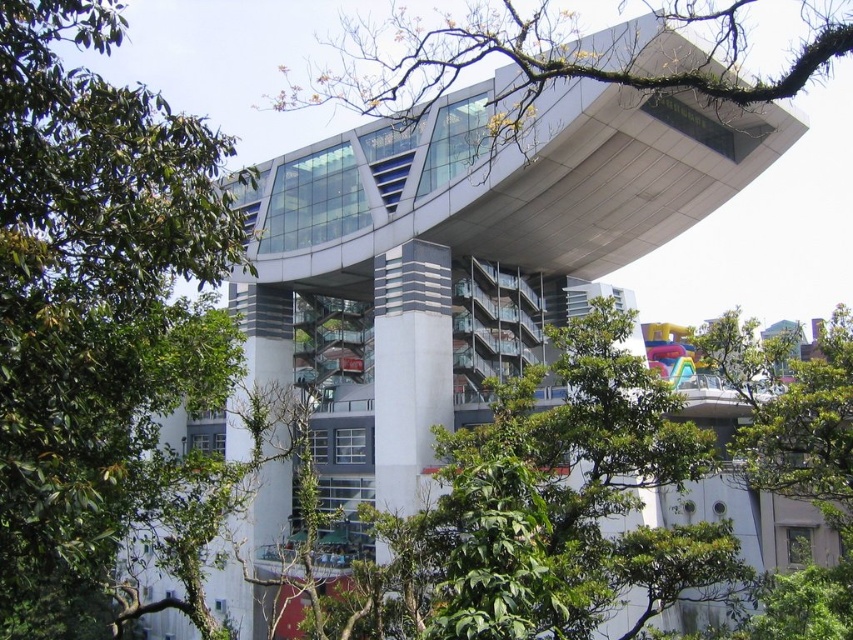
Question: Is green leafy tree at upper left bigger than green leafy branch at upper center?

Choices:
 (A) no
 (B) yes

Answer: (A)

Question: Among these points, which one is farthest from the camera?

Choices:
 (A) (241, 244)
 (B) (521, 120)

Answer: (B)

Question: Is green leafy tree at upper left thinner than green leafy branch at upper center?

Choices:
 (A) yes
 (B) no

Answer: (A)

Question: Can you confirm if green leafy tree at upper left is smaller than green leafy branch at upper center?

Choices:
 (A) no
 (B) yes

Answer: (B)